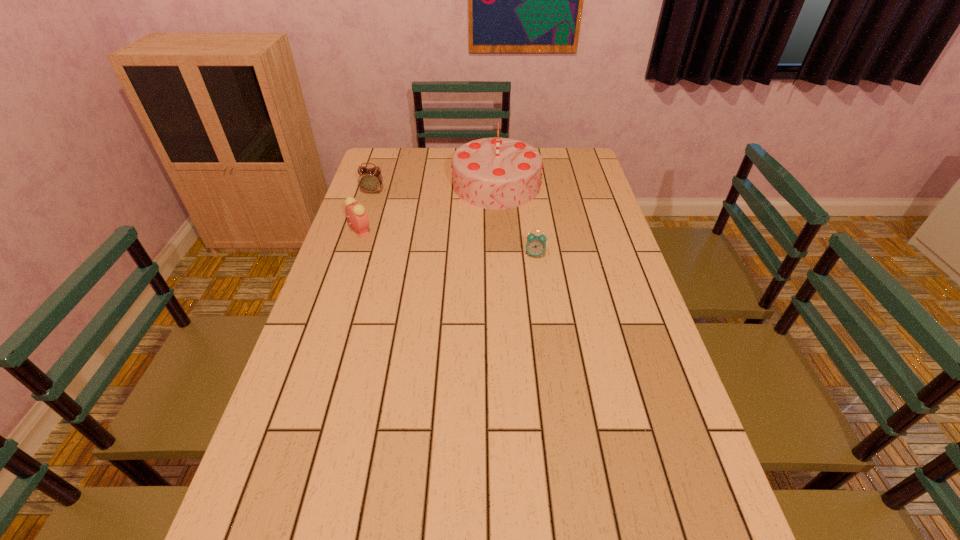
This screenshot has width=960, height=540. In the image, there is a desktop. Identify the location of vacant space at the left edge. (345, 260).

In the image, there is a desktop. At what (x,y) coordinates should I click in order to perform the action: click on vacant area at the right edge. Please return your answer as a coordinate pair (x, y). The image size is (960, 540). Looking at the image, I should click on (615, 337).

Locate an element on the screen. This screenshot has height=540, width=960. free space at the far left corner of the desktop is located at coordinates (395, 165).

Locate an element on the screen. This screenshot has height=540, width=960. vacant area that lies between the farthest alarm clock and the second nearest object is located at coordinates (367, 211).

Identify the location of empty space between the farthest alarm clock and the birthday cake. (435, 188).

Identify the location of free space between the second nearest object and the farthest alarm clock. tap(367, 211).

This screenshot has height=540, width=960. In order to click on blank region between the tallest object and the farthest alarm clock in this screenshot , I will do `click(435, 188)`.

What are the coordinates of `free point between the farthest alarm clock and the tallest object` in the screenshot? It's located at (435, 188).

Find the location of a particular element. The height and width of the screenshot is (540, 960). free space that is in between the nearest alarm clock and the second nearest object is located at coordinates (447, 242).

This screenshot has width=960, height=540. Find the location of `free space between the tallest object and the second nearest object`. free space between the tallest object and the second nearest object is located at coordinates (428, 208).